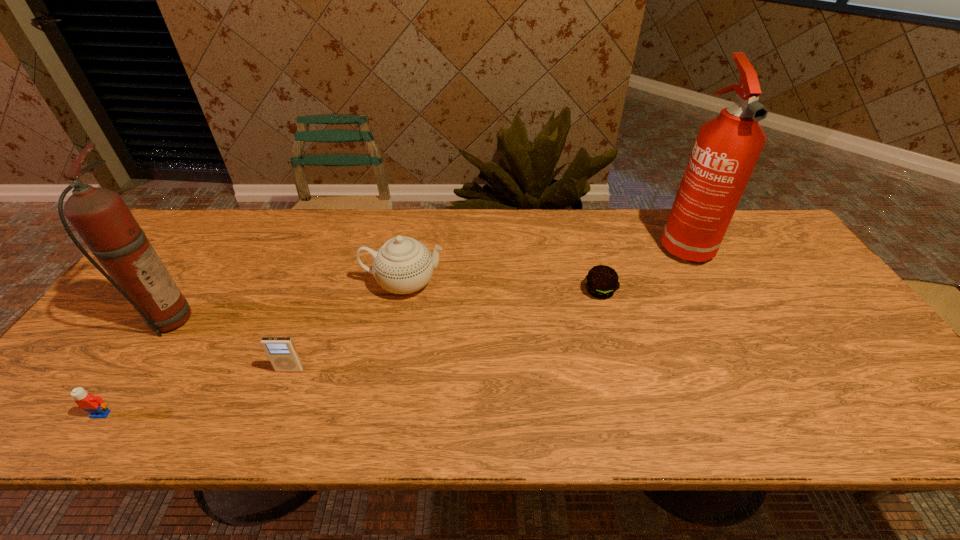
Where is `the shortest object`? The height and width of the screenshot is (540, 960). the shortest object is located at coordinates (601, 282).

Find the location of a particular element. patty is located at coordinates (601, 282).

You are a GUI agent. You are given a task and a screenshot of the screen. Output one action in this format:
    pyautogui.click(x=<x>, y=<y>)
    Task: Click on the vacant region located 0.350m at the nozzle of the taller fire extinguisher
    The width and height of the screenshot is (960, 540).
    Given the screenshot: What is the action you would take?
    pyautogui.click(x=749, y=366)

Where is `vacant space located on the side of the shorter fire extinguisher with the label and nozzle`? The image size is (960, 540). vacant space located on the side of the shorter fire extinguisher with the label and nozzle is located at coordinates (346, 320).

Locate an element on the screen. Image resolution: width=960 pixels, height=540 pixels. free space located 0.230m on the spout of the chinaware is located at coordinates (526, 283).

Find the location of a particular element. free region located 0.100m on the front-facing side of the second nearest object is located at coordinates (275, 411).

I want to click on blank space located 0.150m on the front of the shortest object, so click(615, 347).

You are a GUI agent. You are given a task and a screenshot of the screen. Output one action in this format:
    pyautogui.click(x=<x>, y=<y>)
    Task: Click on the object at the far edge
    
    Given the screenshot: What is the action you would take?
    pyautogui.click(x=726, y=150)

Identify the location of object that is at the near edge. (94, 405).

This screenshot has width=960, height=540. I want to click on fire extinguisher at the left edge, so click(x=100, y=216).